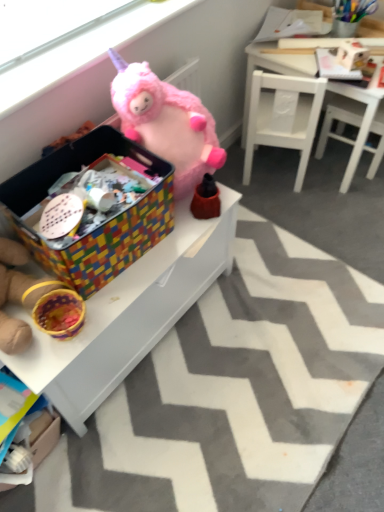
Question: From the image's perspective, is white matte chair at upper right over pink plush unicorn at upper center?

Choices:
 (A) no
 (B) yes

Answer: (A)

Question: Considering the relative sizes of white matte chair at upper right and pink plush unicorn at upper center in the image provided, is white matte chair at upper right taller than pink plush unicorn at upper center?

Choices:
 (A) yes
 (B) no

Answer: (A)

Question: Considering the relative positions of white matte chair at upper right and pink plush unicorn at upper center in the image provided, is white matte chair at upper right behind pink plush unicorn at upper center?

Choices:
 (A) no
 (B) yes

Answer: (B)

Question: Is white matte chair at upper right far from pink plush unicorn at upper center?

Choices:
 (A) no
 (B) yes

Answer: (A)

Question: From a real-world perspective, is white matte chair at upper right under pink plush unicorn at upper center?

Choices:
 (A) yes
 (B) no

Answer: (A)

Question: Would you say white painted wood table at center, the second table from the right, is to the left or to the right of pink plush unicorn at upper center in the picture?

Choices:
 (A) left
 (B) right

Answer: (B)

Question: From their relative heights in the image, would you say white painted wood table at center, which is the second table in top-to-bottom order, is taller or shorter than pink plush unicorn at upper center?

Choices:
 (A) short
 (B) tall

Answer: (B)

Question: Do you think white painted wood table at center, the first table positioned from the left, is within pink plush unicorn at upper center, or outside of it?

Choices:
 (A) outside
 (B) inside

Answer: (A)

Question: Looking at their shapes, would you say white painted wood table at center, which appears as the first table when ordered from the bottom, is wider or thinner than pink plush unicorn at upper center?

Choices:
 (A) thin
 (B) wide

Answer: (B)

Question: Do you think multicolored woven basket at left, which is the third toy in top-to-bottom order, is within multicolored woven storage box at center, or outside of it?

Choices:
 (A) outside
 (B) inside

Answer: (A)

Question: Considering the positions of point (11, 292) and point (155, 217), is point (11, 292) closer or farther from the camera than point (155, 217)?

Choices:
 (A) farther
 (B) closer

Answer: (B)

Question: Visually, is multicolored woven basket at left, the 1th toy ordered from the bottom, positioned to the left or to the right of multicolored woven storage box at center?

Choices:
 (A) left
 (B) right

Answer: (A)

Question: From their relative heights in the image, would you say multicolored woven basket at left, the 1th toy ordered from the bottom, is taller or shorter than multicolored woven storage box at center?

Choices:
 (A) short
 (B) tall

Answer: (A)

Question: Relative to white wooden table at upper right, the first table in the top-to-bottom sequence, is cardboard box at lower left in front or behind?

Choices:
 (A) front
 (B) behind

Answer: (A)

Question: Is cardboard box at lower left inside the boundaries of white wooden table at upper right, the first table in the top-to-bottom sequence, or outside?

Choices:
 (A) inside
 (B) outside

Answer: (B)